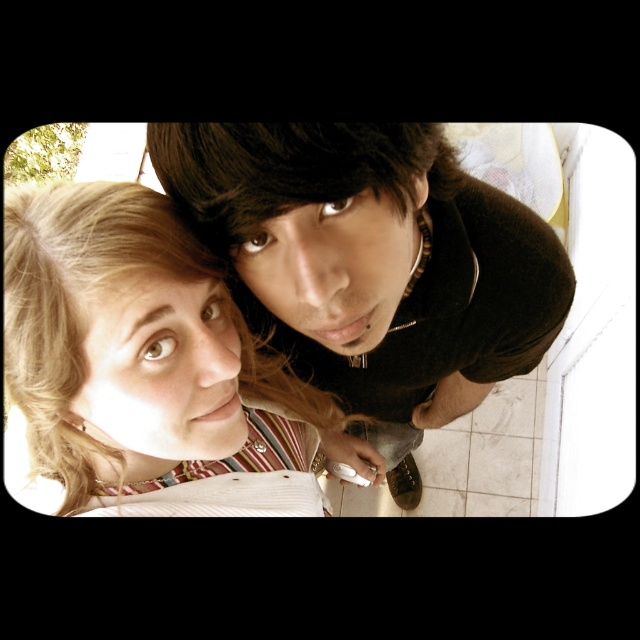
From the picture: You are a photographer trying to capture a candid shot of the two people in the scene. You want to ensure that the dark brown corduroy shirt at upper center and the blonde hair at upper left are both clearly visible in the frame. Based on their positions, which object should you focus on first to ensure both are in focus?

The dark brown corduroy shirt at upper center is in front of the blonde hair at upper left, so focusing on the dark brown corduroy shirt at upper center first will help ensure both are in focus since it is closer to the camera.

You are trying to determine if a small decorative item placed on the dark brown corduroy shirt at upper center would also fit on the blonde hair at upper left. Based on their widths, can the item fit?

The dark brown corduroy shirt at upper center might be wider than blonde hair at upper left, so the item that fits on the shirt might also fit on the blonde hair at upper left if the hair is narrower, but there is uncertainty due to the comparison being uncertain.

You are a photographer standing 20 inches away from the camera. You want to take a photo of the dark brown corduroy shirt at upper center. Is the shirt within your camera range?

The dark brown corduroy shirt at upper center is 15.77 inches away from the camera, which is within the photographer standing 20 inches away. Therefore, the shirt is within the camera range.